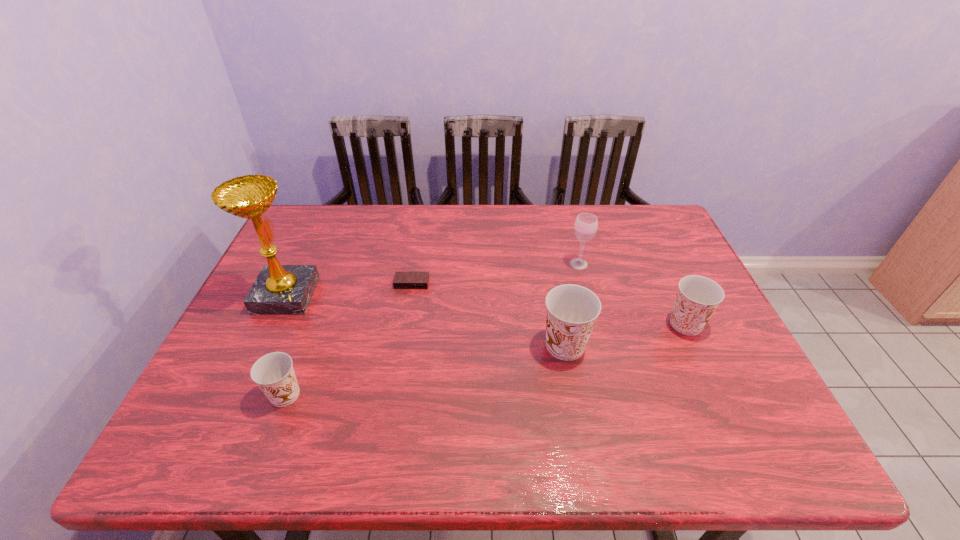
In order to click on free space between the tallest Dixie cup and the tallest object in this screenshot , I will do `click(425, 320)`.

In order to click on empty location between the tallest Dixie cup and the leftmost Dixie cup in this screenshot , I will do `click(425, 370)`.

You are a GUI agent. You are given a task and a screenshot of the screen. Output one action in this format:
    pyautogui.click(x=<x>, y=<y>)
    Task: Click on the free spot between the alarm clock and the second Dixie cup from left to right
    
    Given the screenshot: What is the action you would take?
    pyautogui.click(x=489, y=314)

Locate an element on the screen. The height and width of the screenshot is (540, 960). vacant region between the tallest Dixie cup and the award is located at coordinates (425, 320).

Find the location of `free space between the award and the tallest Dixie cup`. free space between the award and the tallest Dixie cup is located at coordinates (425, 320).

This screenshot has height=540, width=960. What are the coordinates of `vacant region between the shortest Dixie cup and the award` in the screenshot? It's located at (286, 345).

Locate an element on the screen. This screenshot has height=540, width=960. object that is the fourth closest to the fifth tallest object is located at coordinates (585, 227).

The height and width of the screenshot is (540, 960). Find the location of `object that is the third nearest to the award`. object that is the third nearest to the award is located at coordinates (572, 310).

In order to click on Dixie cup that is the closest one to the second Dixie cup from right to left in this screenshot , I will do `click(697, 298)`.

Identify which Dixie cup is the second closest to the nearest Dixie cup. Please provide its 2D coordinates. Your answer should be formatted as a tuple, i.e. [(x, y)], where the tuple contains the x and y coordinates of a point satisfying the conditions above.

[(697, 298)]